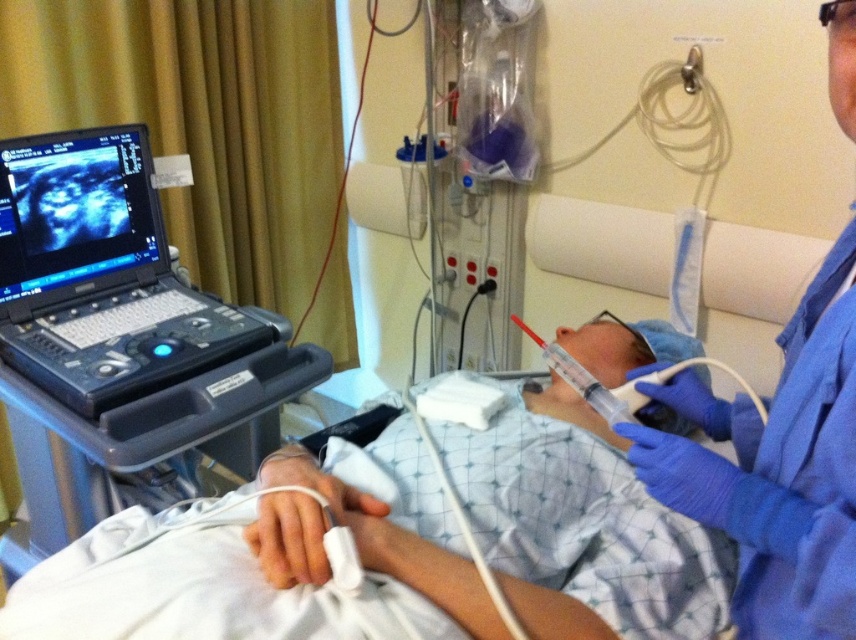
You are a medical student observing a procedure. You notice two points marked in the scene. The first point is at coordinates point (765, 460) and the second is at point (211, 346). Which point is closer to you?

A: Point (765, 460) is closer to the viewer than point (211, 346).

Please provide the coordinates of the black plastic laptop at upper left in the image. The coordinates should be in the format of a point with two decimal places, like point (100, 275).

The black plastic laptop at upper left is located at point (100, 275).